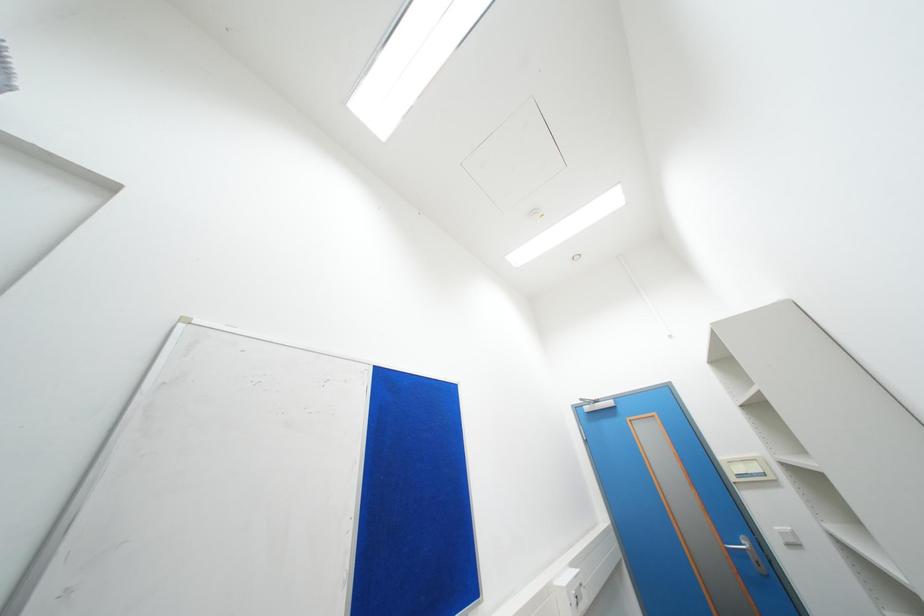
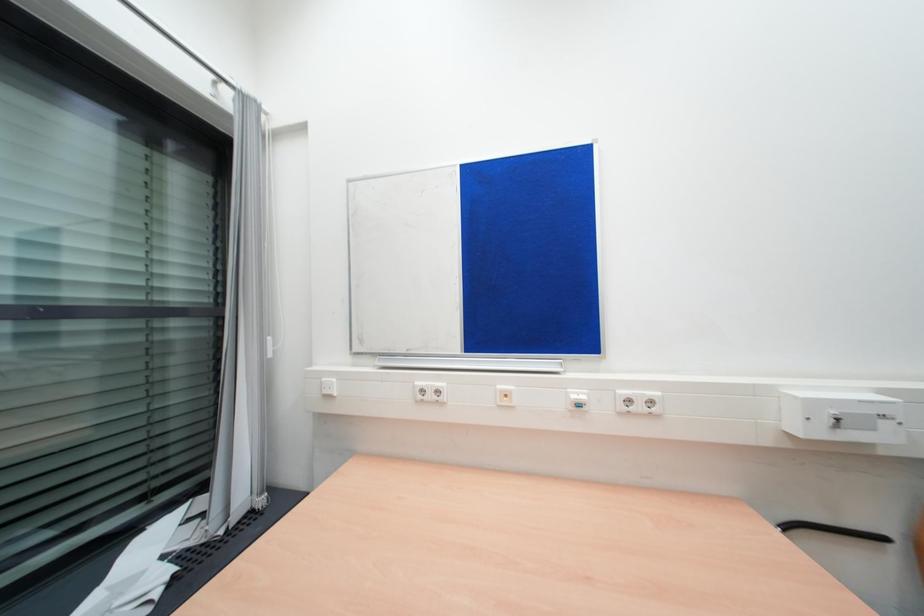
Looking at this image, the images are taken continuously from a first-person perspective. In which direction is your viewpoint rotating?

The camera rotated toward left-down.